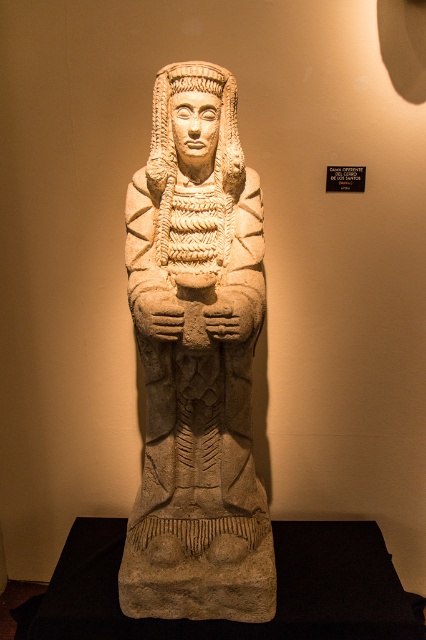
Is point (137, 536) in front of point (227, 68)?

No.

Is beige stone statue at center bigger than beige stone headdress at center?

Indeed, beige stone statue at center has a larger size compared to beige stone headdress at center.

Which is behind, point (258, 186) or point (203, 259)?

The point (258, 186) is behind.

Identify the location of beige stone statue at center. This screenshot has height=640, width=426. (196, 360).